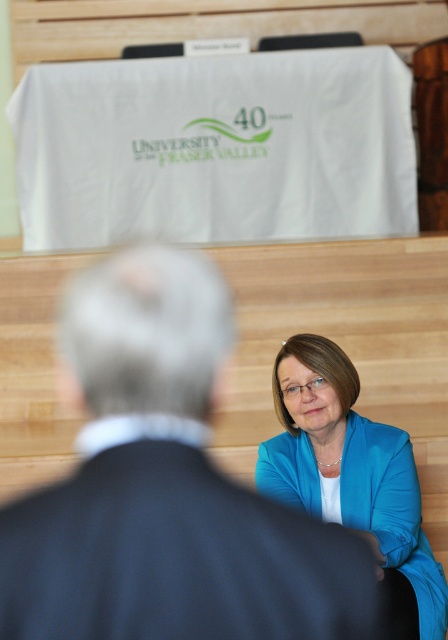
You are organizing a photo shoot and need to adjust the distance between the dark blue suit at center and the blue fabric jacket at lower right to exactly 5 feet. Currently, they are 6.58 feet apart. What adjustment should you make?

The dark blue suit at center and the blue fabric jacket at lower right are currently 6.58 feet apart. To reduce the distance to exactly 5 feet, you should move them closer together by approximately 1.58 feet.

You are organizing a formal event and need to know if the dark blue suit at center can fit into a storage space designed for the blue fabric jacket at lower right. Based on their sizes, will it fit?

The dark blue suit at center is narrower than the blue fabric jacket at lower right, so it should fit into the storage space designed for the jacket.